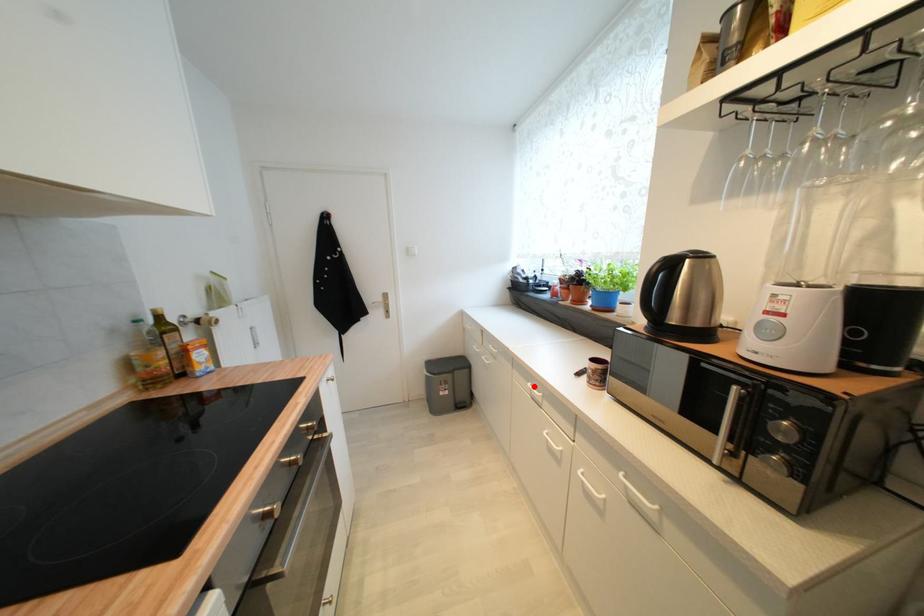
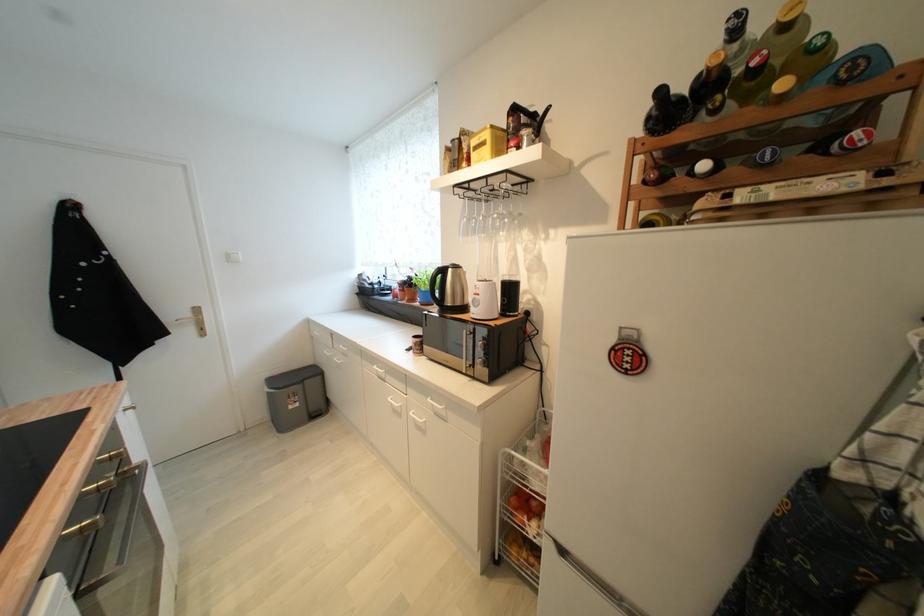
Question: I am providing you with two images of the same scene from different viewpoints. A red point is shown in image1. For the corresponding object point in image2, is it positioned nearer or farther from the camera?

Choices:
 (A) Nearer
 (B) Farther

Answer: (B)